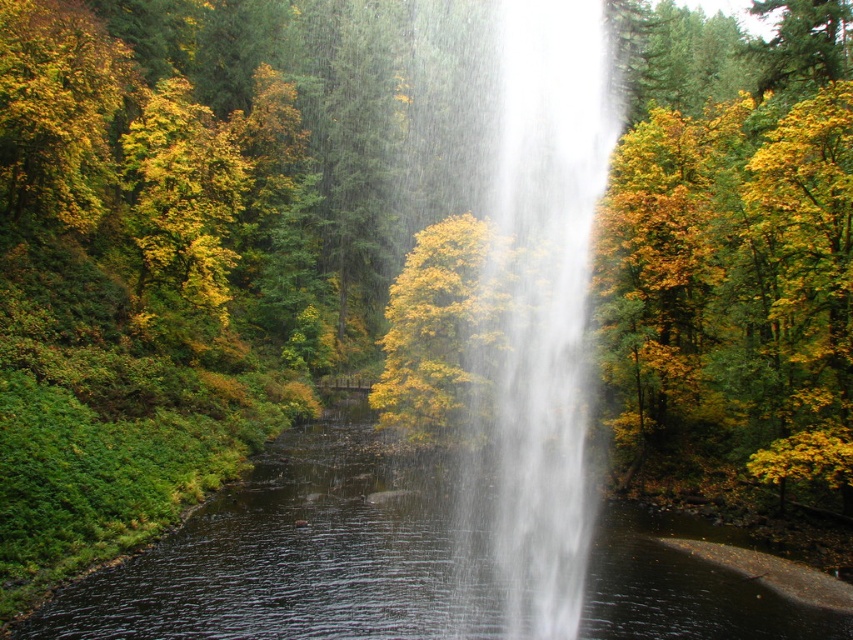
You are standing in the forest near the waterfall and want to reach a hidden treasure located at point (440, 624). There is an obstacle at point (502, 29). Can you walk around the obstacle to reach the treasure?

Point (502, 29) is further to the viewer than point (440, 624), so the obstacle is closer to you. You can walk around it to reach the treasure at point (440, 624).

You are a photographer planning to capture the waterfall and the pool in the scene. Given that the white misty waterfall at center is larger than the transparent water at center, which object should you focus on to ensure both are visible in your photo?

Since the white misty waterfall at center is larger than the transparent water at center, you should focus on the white misty waterfall at center to ensure both are visible in your photo.